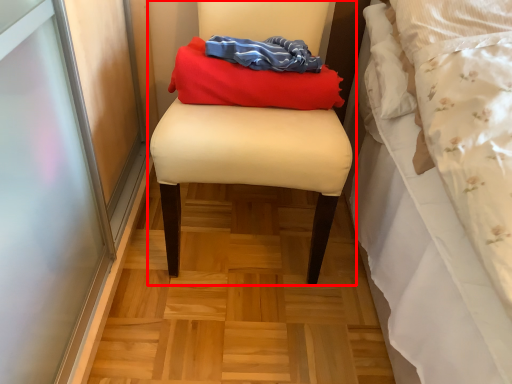
Question: From the image's perspective, where is furniture (annotated by the red box) located relative to laundry?

Choices:
 (A) above
 (B) below

Answer: (B)